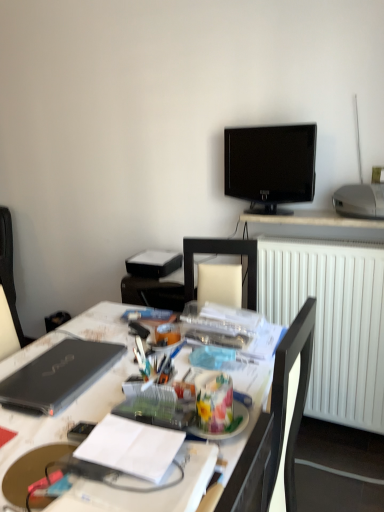
Question: Does point (200, 407) appear closer or farther from the camera than point (44, 353)?

Choices:
 (A) closer
 (B) farther

Answer: (A)

Question: In terms of size, does translucent plastic container at center appear bigger or smaller than black matte laptop at left?

Choices:
 (A) big
 (B) small

Answer: (B)

Question: Considering the real-world distances, which object is closest to the black matte laptop at left?

Choices:
 (A) translucent plastic container at center
 (B) dark gray fabric computer chair at left
 (C) white matte radiator at right
 (D) white paper notebook at center
 (E) silver metallic projector at upper right

Answer: (D)

Question: Which is nearer to the white glossy desk at center?

Choices:
 (A) silver metallic projector at upper right
 (B) black matte laptop at left
 (C) white paper notebook at center
 (D) white matte radiator at right
 (E) translucent plastic container at center

Answer: (B)